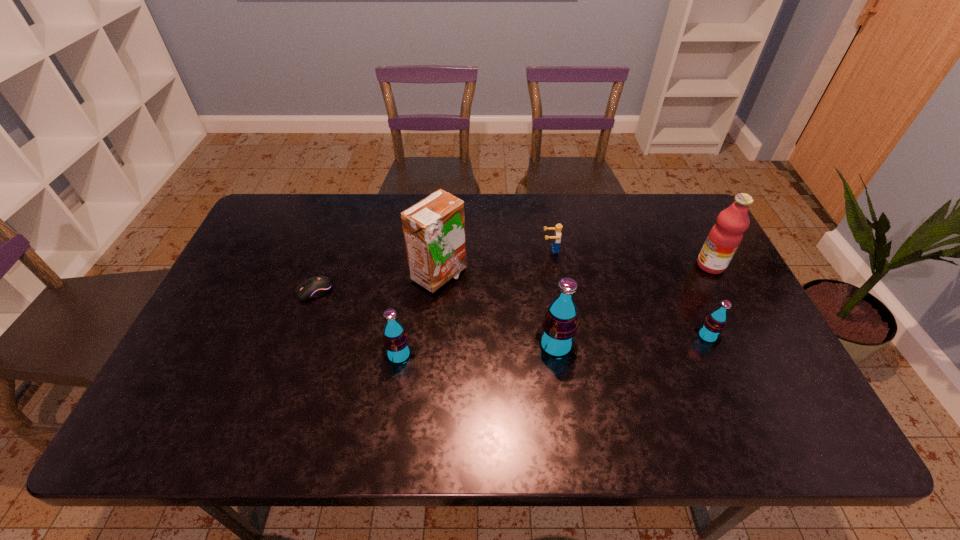
You are a GUI agent. You are given a task and a screenshot of the screen. Output one action in this format:
    pyautogui.click(x=<x>, y=<y>)
    Task: Click on the vacant space at the near left corner
    This screenshot has width=960, height=540.
    Given the screenshot: What is the action you would take?
    pyautogui.click(x=232, y=379)

Image resolution: width=960 pixels, height=540 pixels. I want to click on vacant area that lies between the carton and the shortest object, so click(x=376, y=284).

Where is `free spot between the leftmost object and the rightmost soda`? free spot between the leftmost object and the rightmost soda is located at coordinates (511, 314).

Where is `vacant region between the computer mouse and the sixth object from left to right`? This screenshot has height=540, width=960. vacant region between the computer mouse and the sixth object from left to right is located at coordinates (x=511, y=314).

At what (x,y) coordinates should I click in order to perform the action: click on free space between the second soda from right to left and the fourth tallest object. Please return your answer as a coordinate pair (x, y). Image resolution: width=960 pixels, height=540 pixels. Looking at the image, I should click on (477, 350).

Find the location of a particular element. This screenshot has height=540, width=960. free space between the carton and the rightmost object is located at coordinates (575, 271).

Where is `free space between the farthest object and the rightmost object`? free space between the farthest object and the rightmost object is located at coordinates (631, 257).

Locate an element on the screen. The height and width of the screenshot is (540, 960). vacant space in between the rightmost object and the computer mouse is located at coordinates (513, 278).

Where is `empty space between the fifth tallest object and the rightmost object`? The image size is (960, 540). empty space between the fifth tallest object and the rightmost object is located at coordinates (708, 301).

Where is `object that ranks as the closest to the leftmost soda`? object that ranks as the closest to the leftmost soda is located at coordinates (434, 229).